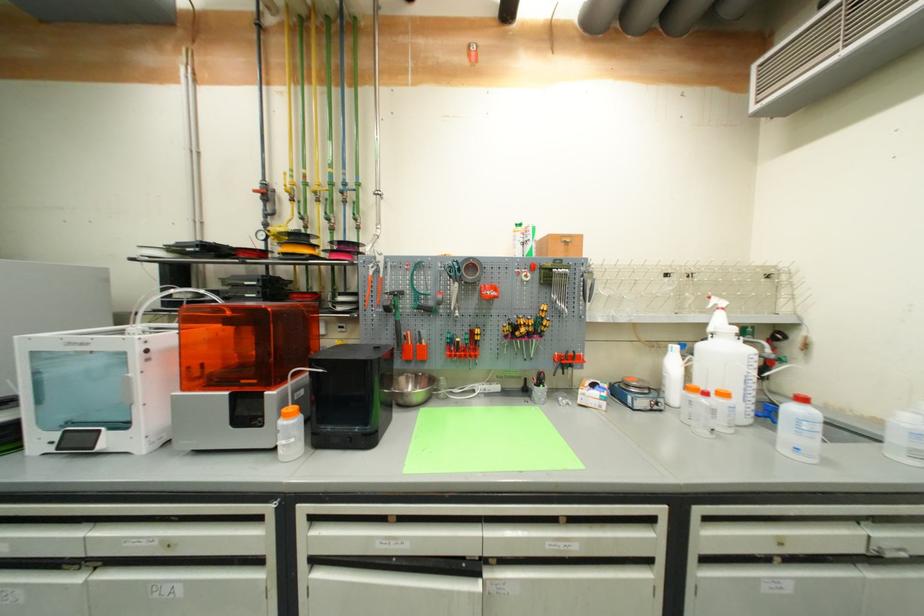
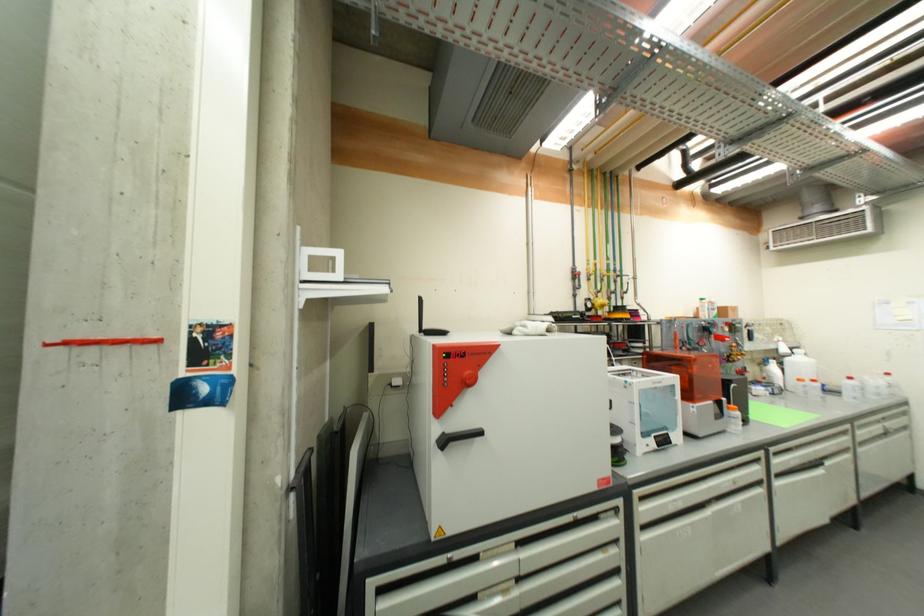
In the second image, find the point that corresponds to [294,418] in the first image.

(739, 411)